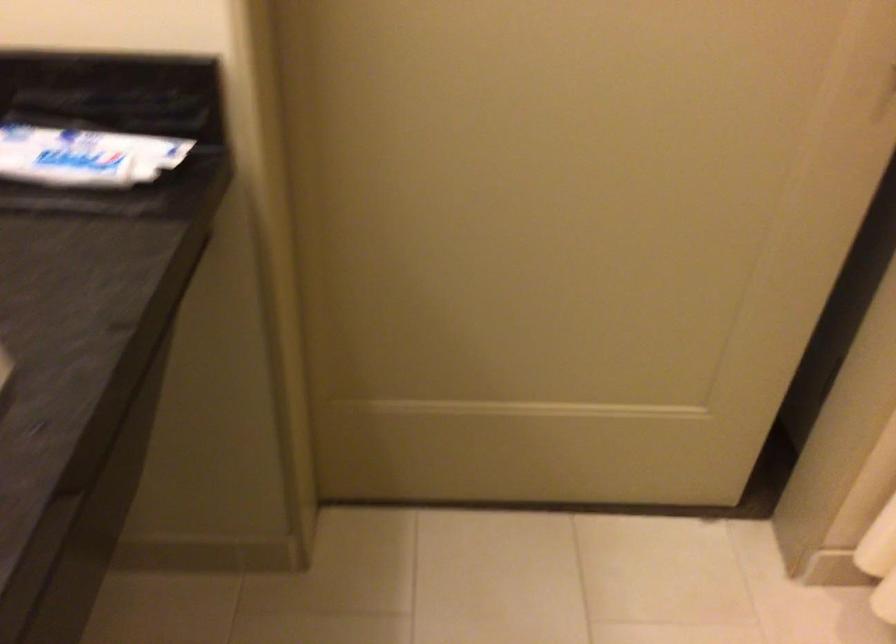
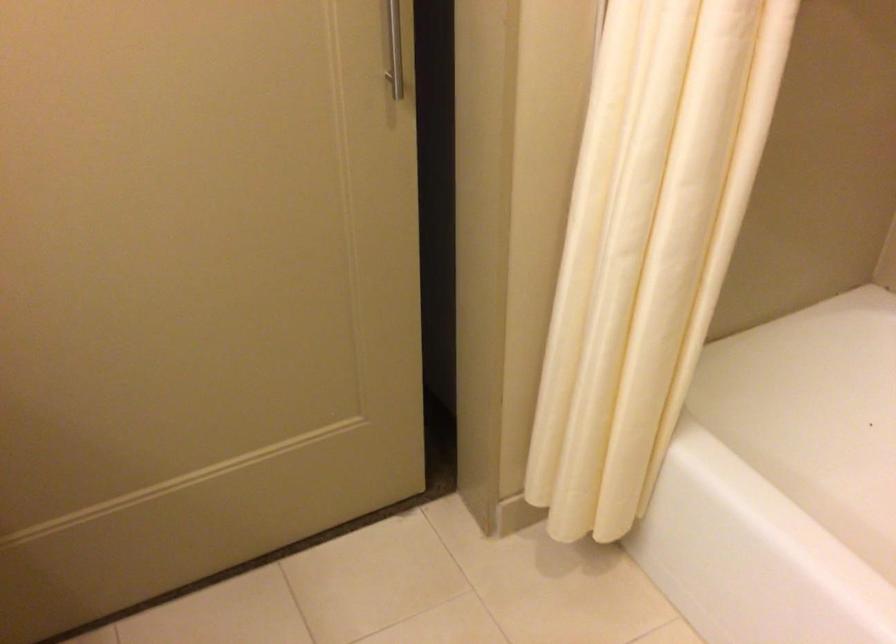
Question: The images are taken continuously from a first-person perspective. In which direction are you moving?

Choices:
 (A) Left
 (B) Right
 (C) Forward
 (D) Backward

Answer: (B)